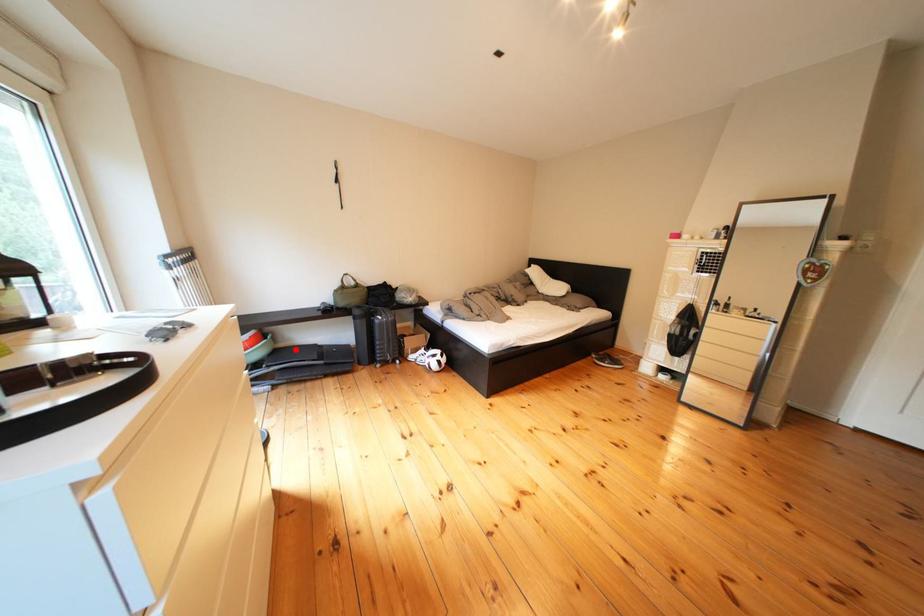
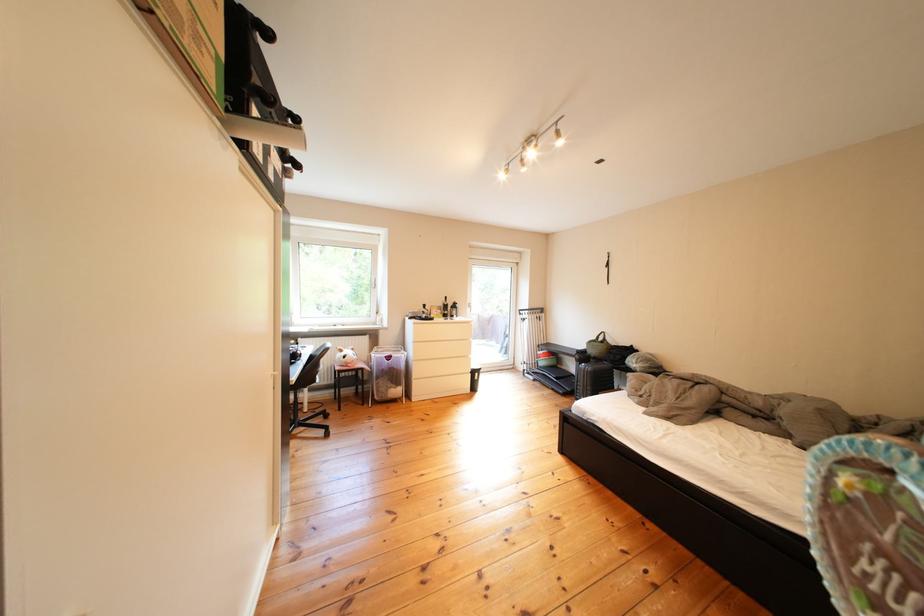
Question: I am providing you with two images of the same scene from different viewpoints. Given a red point in image1, look at the same physical point in image2. Is it:

Choices:
 (A) Closer to the viewpoint
 (B) Farther from the viewpoint

Answer: (B)